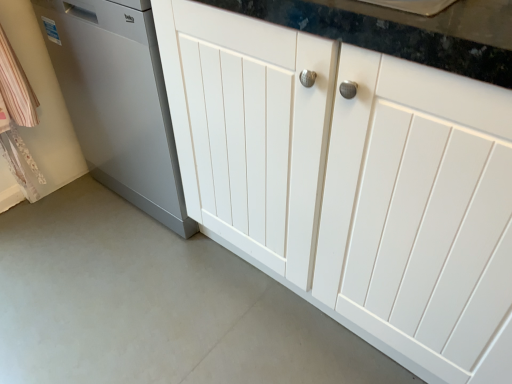
The height and width of the screenshot is (384, 512). What are the coordinates of `white wood cabinet at center` in the screenshot? It's located at (352, 183).

Would you say satin silver dishwasher at left is outside white wood cabinet at center?

Indeed, satin silver dishwasher at left is completely outside white wood cabinet at center.

Considering the positions of objects satin silver dishwasher at left and white wood cabinet at center in the image provided, who is more to the right, satin silver dishwasher at left or white wood cabinet at center?

white wood cabinet at center.

Does satin silver dishwasher at left have a lesser height compared to white wood cabinet at center?

Yes.

Does white wood cabinet at center turn towards white smooth concrete at lower center?

Yes, white wood cabinet at center is facing white smooth concrete at lower center.

Is white wood cabinet at center taller or shorter than white smooth concrete at lower center?

In the image, white wood cabinet at center appears to be taller than white smooth concrete at lower center.

Is white wood cabinet at center in contact with white smooth concrete at lower center?

No.

In terms of size, does white smooth concrete at lower center appear bigger or smaller than satin silver dishwasher at left?

Clearly, white smooth concrete at lower center is smaller in size than satin silver dishwasher at left.

Is white smooth concrete at lower center next to satin silver dishwasher at left and touching it?

No, white smooth concrete at lower center is not making contact with satin silver dishwasher at left.

From a real-world perspective, is white smooth concrete at lower center located beneath satin silver dishwasher at left?

Yes.

Between white smooth concrete at lower center and satin silver dishwasher at left, which one has more height?

Standing taller between the two is satin silver dishwasher at left.

From the image's perspective, is white smooth concrete at lower center above or below white wood cabinet at center?

From the image's perspective, white smooth concrete at lower center appears below white wood cabinet at center.

Is white smooth concrete at lower center located outside white wood cabinet at center?

Yes.

Is white smooth concrete at lower center aimed at white wood cabinet at center?

No.

Considering the sizes of white smooth concrete at lower center and white wood cabinet at center in the image, is white smooth concrete at lower center taller or shorter than white wood cabinet at center?

Considering their sizes, white smooth concrete at lower center has less height than white wood cabinet at center.

Is point (412, 97) less distant than point (120, 81)?

Yes.

Based on the photo, is white wood cabinet at center wider or thinner than satin silver dishwasher at left?

In the image, white wood cabinet at center appears to be wider than satin silver dishwasher at left.

Image resolution: width=512 pixels, height=384 pixels. Identify the location of home appliance lying above the white wood cabinet at center (from the image's perspective). point(118,101).

Can you confirm if white wood cabinet at center is taller than satin silver dishwasher at left?

Yes.

How different are the orientations of satin silver dishwasher at left and white smooth concrete at lower center in degrees?

satin silver dishwasher at left and white smooth concrete at lower center are facing 0.637 degrees away from each other.

From the image's perspective, which is above, satin silver dishwasher at left or white smooth concrete at lower center?

From the image's view, satin silver dishwasher at left is above.

Does point (142, 28) appear closer or farther from the camera than point (223, 248)?

Point (142, 28).

Does satin silver dishwasher at left contain white smooth concrete at lower center?

No, white smooth concrete at lower center is located outside of satin silver dishwasher at left.

Find the location of a particular element. cabinetry on the right side of satin silver dishwasher at left is located at coordinates (352, 183).

I want to click on concrete behind the white wood cabinet at center, so click(x=154, y=305).

Looking at the image, which one is located closer to satin silver dishwasher at left, white smooth concrete at lower center or white wood cabinet at center?

white wood cabinet at center is positioned closer to the anchor satin silver dishwasher at left.

Which object lies further to the anchor point white wood cabinet at center, satin silver dishwasher at left or white smooth concrete at lower center?

The object further to white wood cabinet at center is white smooth concrete at lower center.

From the image, which object appears to be nearer to satin silver dishwasher at left, white wood cabinet at center or white smooth concrete at lower center?

white wood cabinet at center.

Estimate the real-world distances between objects in this image. Which object is further from white wood cabinet at center, white smooth concrete at lower center or satin silver dishwasher at left?

white smooth concrete at lower center is further to white wood cabinet at center.

Looking at the image, which one is located further to white smooth concrete at lower center, white wood cabinet at center or satin silver dishwasher at left?

The object further to white smooth concrete at lower center is white wood cabinet at center.

In the scene shown: Considering their positions, is satin silver dishwasher at left positioned further to white smooth concrete at lower center than white wood cabinet at center?

Based on the image, white wood cabinet at center appears to be further to white smooth concrete at lower center.

This screenshot has width=512, height=384. In order to click on home appliance between white smooth concrete at lower center and white wood cabinet at center in this screenshot , I will do `click(118, 101)`.